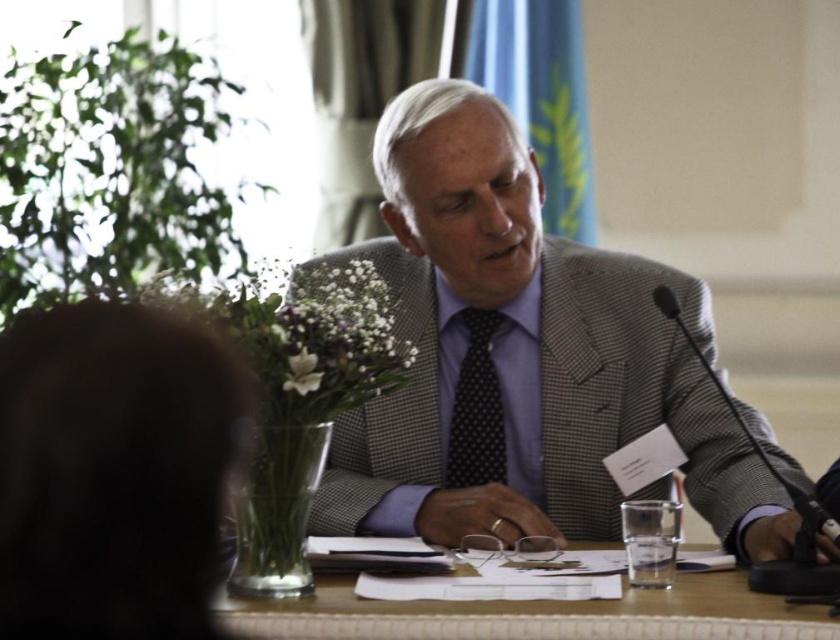
Question: Estimate the real-world distances between objects in this image. Which object is farther from the polka dot silk tie at center?

Choices:
 (A) gray textured suit at center
 (B) wooden table at center

Answer: (B)

Question: Which of the following is the closest to the observer?

Choices:
 (A) polka dot silk tie at center
 (B) wooden table at center

Answer: (B)

Question: Can you confirm if gray textured suit at center is bigger than wooden table at center?

Choices:
 (A) yes
 (B) no

Answer: (A)

Question: Considering the relative positions of gray textured suit at center and wooden table at center in the image provided, where is gray textured suit at center located with respect to wooden table at center?

Choices:
 (A) below
 (B) above

Answer: (B)

Question: In this image, where is gray textured suit at center located relative to wooden table at center?

Choices:
 (A) left
 (B) right

Answer: (A)

Question: Which point is farther from the camera taking this photo?

Choices:
 (A) 399,204
 (B) 492,456
 (C) 675,632

Answer: (B)